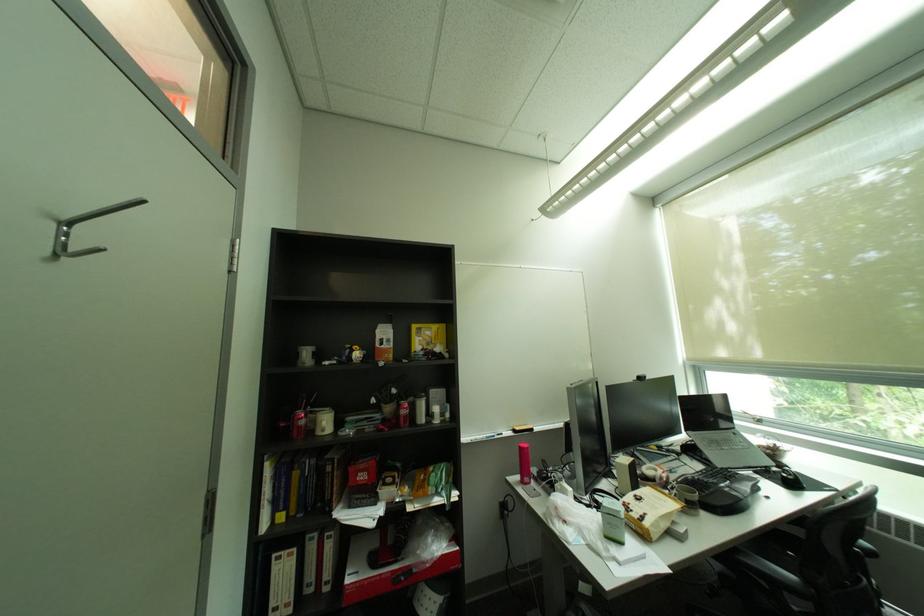
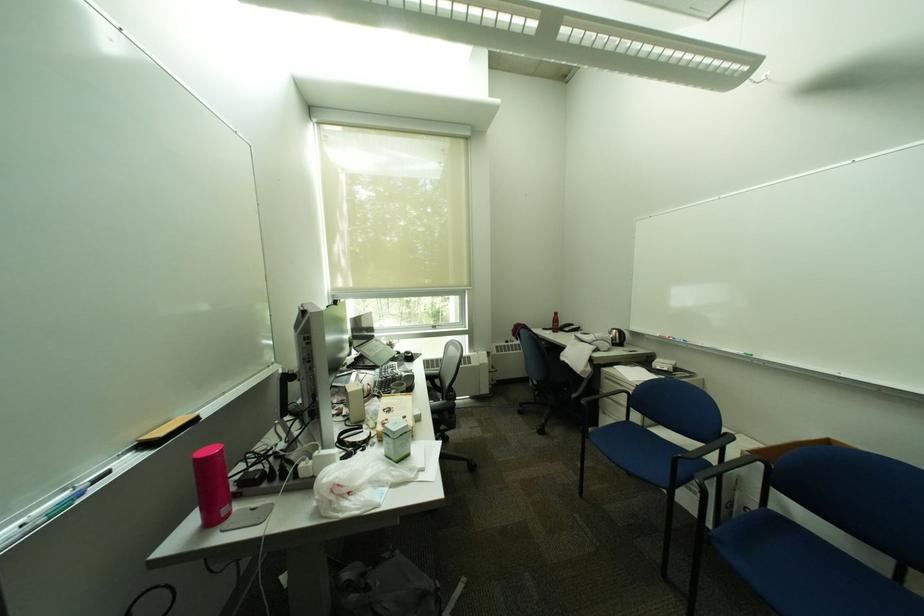
Question: The camera is either moving clockwise (left) or counter-clockwise (right) around the object. The first image is from the beginning of the video and the second image is from the end. Is the camera moving left or right when shooting the video?

Choices:
 (A) Left
 (B) Right

Answer: (A)